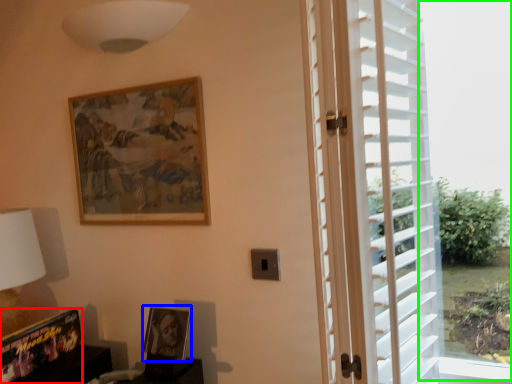
Question: Estimate the real-world distances between objects in this image. Which object is closer to picture frame (highlighted by a red box), picture frame (highlighted by a blue box) or window screen (highlighted by a green box)?

Choices:
 (A) picture frame
 (B) window screen

Answer: (A)